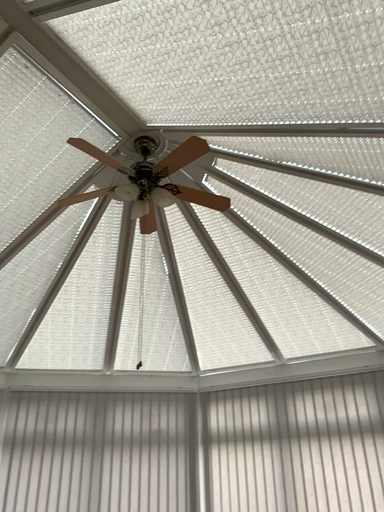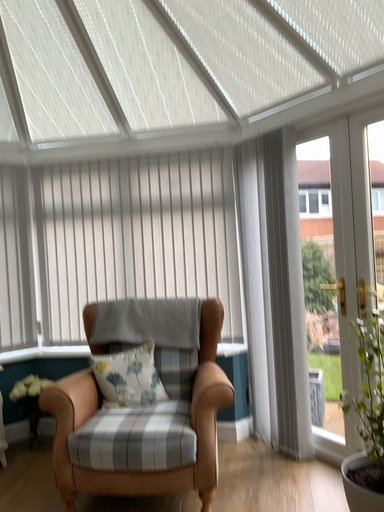
Question: Which way did the camera rotate in the video?

Choices:
 (A) rotated downward
 (B) rotated upward

Answer: (A)